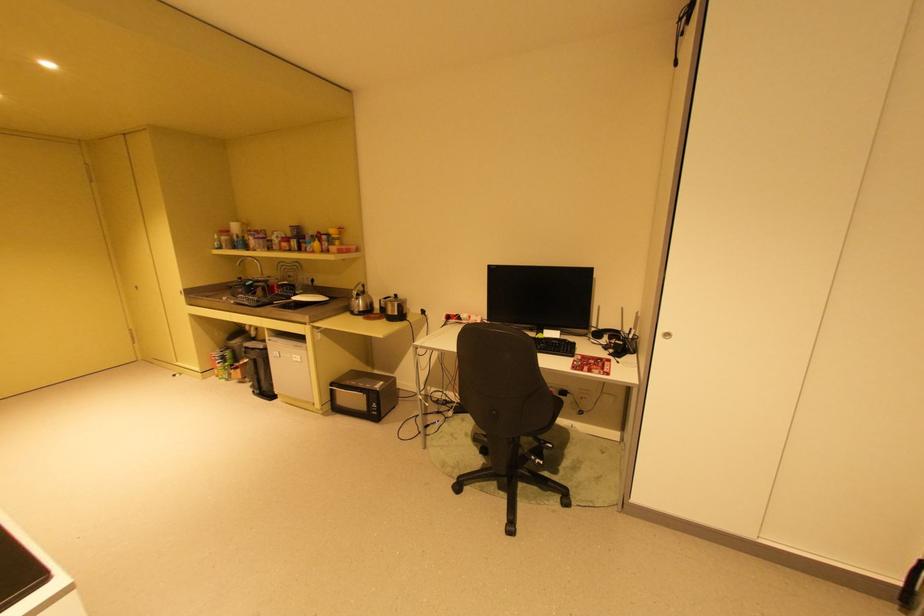
Find where to plac the black trash can. Please return your answer as a coordinate pair (x, y).

(259, 369)